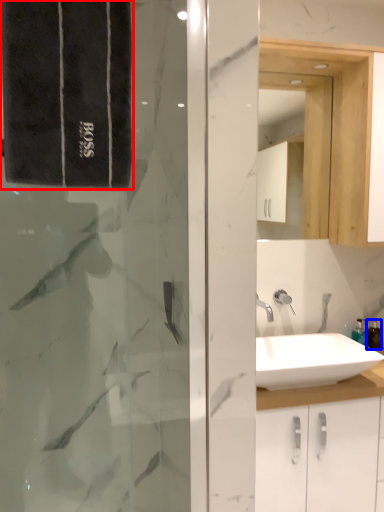
Question: Which object appears farthest to the camera in this image, bath towel (highlighted by a red box) or toiletry (highlighted by a blue box)?

Choices:
 (A) bath towel
 (B) toiletry

Answer: (B)